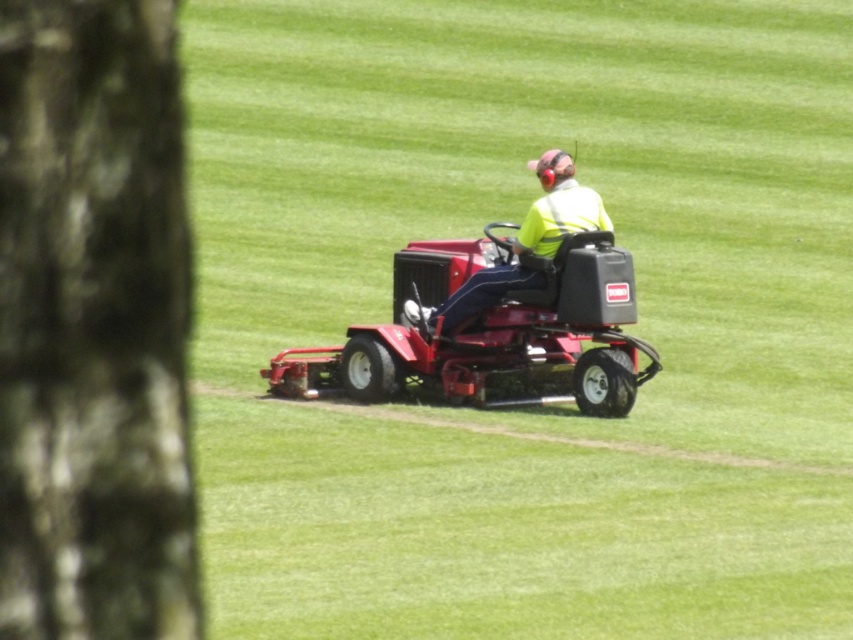
You are a safety inspector checking the scene. The yellow reflective vest at center must be visible from a distance. Considering the height of the dark brown bark at left compared to the vest, is the vest likely visible over the bark? Please explain.

The dark brown bark at left is not as tall as the yellow reflective vest at center, so the vest is likely visible over the bark because it is taller.

You are a drone operator flying a drone that has a minimum safe operating distance of 10 meters from any object on the ground. You need to fly the drone over the area shown in the image. Is the distance between the dark brown bark at left and the yellow reflective vest at center sufficient to maintain the drone safety requirements?

The distance between the dark brown bark at left and the yellow reflective vest at center is 11.45 meters, which exceeds the minimum safe operating distance of 10 meters. Therefore, the drone can safely fly over the area while maintaining the required distance from both objects.